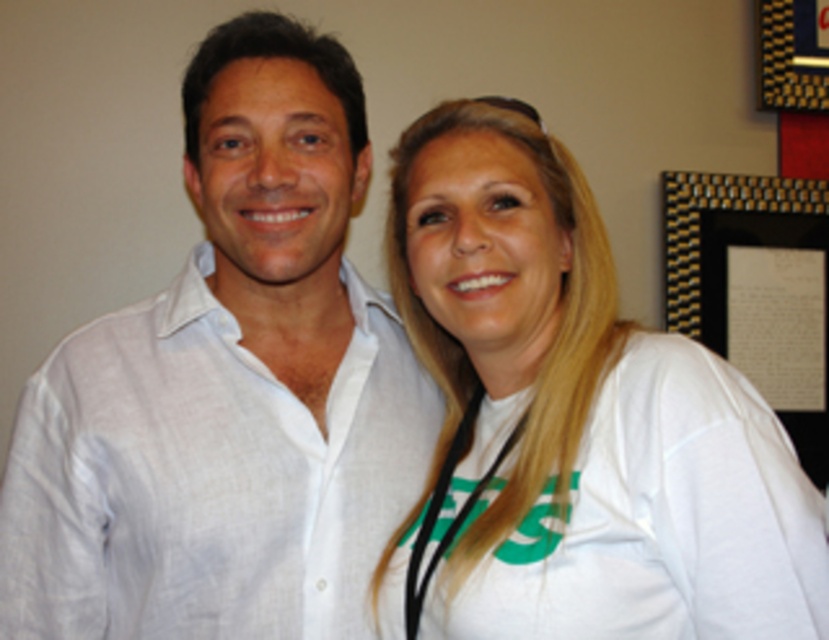
Locate an element on the screen. The width and height of the screenshot is (829, 640). white cotton t-shirt at center is located at coordinates (573, 422).

Is white cotton t-shirt at center below gold textured frame at upper right?

Yes, white cotton t-shirt at center is below gold textured frame at upper right.

Does point (497, 596) come closer to viewer compared to point (789, 51)?

Yes, point (497, 596) is in front of point (789, 51).

Locate an element on the screen. Image resolution: width=829 pixels, height=640 pixels. white cotton t-shirt at center is located at coordinates (573, 422).

Is black glossy picture frame at upper right taller than gold textured frame at upper right?

Yes, black glossy picture frame at upper right is taller than gold textured frame at upper right.

Between black glossy picture frame at upper right and gold textured frame at upper right, which one appears on the right side from the viewer's perspective?

From the viewer's perspective, gold textured frame at upper right appears more on the right side.

Is point (822, 465) behind point (784, 100)?

That is True.

This screenshot has height=640, width=829. Find the location of `black glossy picture frame at upper right`. black glossy picture frame at upper right is located at coordinates (755, 289).

Where is `white linen shirt at center`? white linen shirt at center is located at coordinates (206, 476).

Who is shorter, white linen shirt at center or gold textured frame at upper right?

gold textured frame at upper right

Who is more distant from viewer, (x=81, y=346) or (x=812, y=88)?

The point (x=812, y=88) is behind.

The height and width of the screenshot is (640, 829). Identify the location of white linen shirt at center. (206, 476).